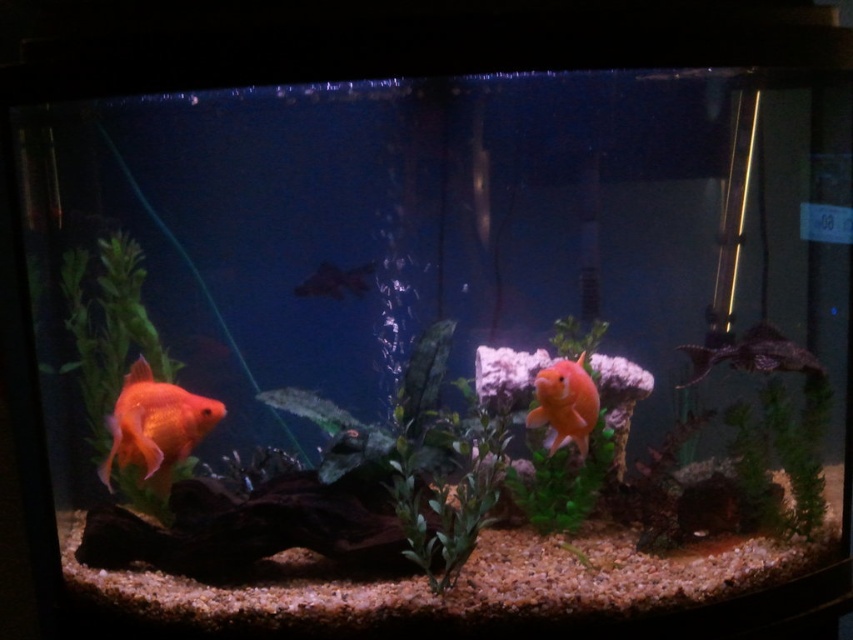
Can you confirm if green leafy plant at left is taller than shiny silver fish at right?

Yes, green leafy plant at left is taller than shiny silver fish at right.

Where is `green leafy plant at left`? This screenshot has height=640, width=853. green leafy plant at left is located at coordinates pyautogui.click(x=109, y=337).

The height and width of the screenshot is (640, 853). Identify the location of green leafy plant at left. (109, 337).

Is matte orange goldfish at center thinner than matte black fish at center?

Correct, matte orange goldfish at center's width is less than matte black fish at center's.

Who is shorter, matte orange goldfish at center or matte black fish at center?

matte black fish at center is shorter.

At what (x,y) coordinates should I click in order to perform the action: click on matte orange goldfish at center. Please return your answer as a coordinate pair (x, y). The image size is (853, 640). Looking at the image, I should click on (564, 404).

Locate an element on the screen. The width and height of the screenshot is (853, 640). matte orange goldfish at center is located at coordinates (564, 404).

Who is higher up, shiny orange fish at lower left or matte orange goldfish at center?

matte orange goldfish at center

Does shiny orange fish at lower left appear under matte orange goldfish at center?

Correct, shiny orange fish at lower left is located below matte orange goldfish at center.

Image resolution: width=853 pixels, height=640 pixels. I want to click on shiny orange fish at lower left, so click(155, 426).

Where is `shiny orange fish at lower left`? The height and width of the screenshot is (640, 853). shiny orange fish at lower left is located at coordinates (155, 426).